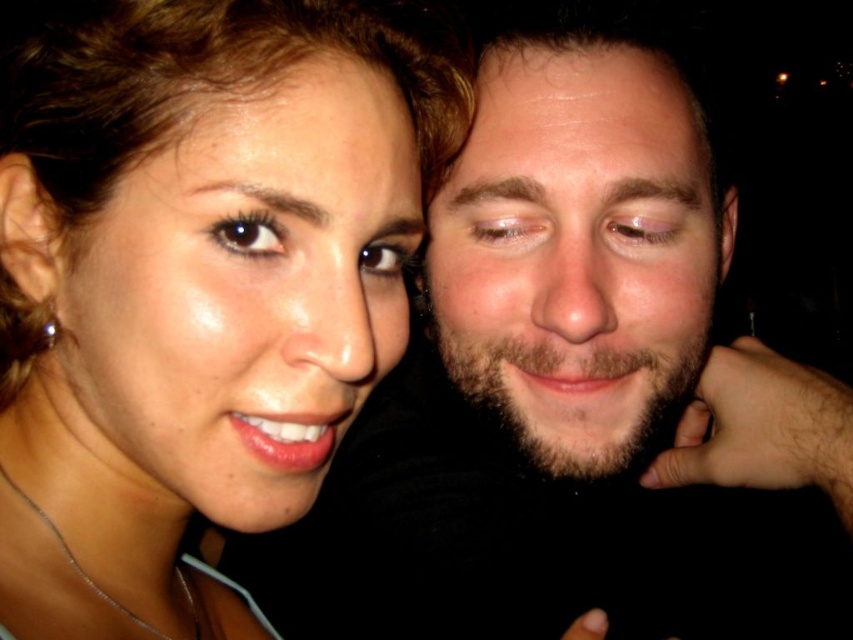
You are a photographer adjusting the focus on your camera. You notice two points in the image at coordinates point (x=544, y=333) and point (x=589, y=168). If you want to focus on the closer point to ensure sharpness, which coordinate should you choose?

Point (x=589, y=168) is closer to the camera than point (x=544, y=333), so you should focus on point (x=589, y=168) to ensure sharpness.

In the scene shown: Looking at the image, which object is bigger between the bearded face at right and the dry skin forehead at upper center?

The bearded face at right is larger in size than the dry skin forehead at upper center.

You are a photographer adjusting the focus on your camera. You need to ensure that the point at coordinate point (682,109) is in focus. What is the minimum distance you should set the focus to capture this point clearly?

The minimum distance you should set the focus to capture the point at coordinate point (682,109) clearly is 51.89 centimeters, as the distance between them is exactly 51.89 centimeters.